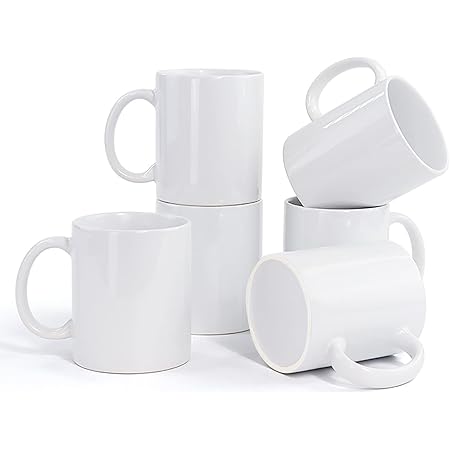
You are a GUI agent. You are given a task and a screenshot of the screen. Output one action in this format:
    pyautogui.click(x=<x>, y=<y>)
    Task: Click on the mug handles
    This screenshot has height=450, width=450.
    Given the screenshot: What is the action you would take?
    pyautogui.click(x=320, y=77), pyautogui.click(x=120, y=105), pyautogui.click(x=39, y=245), pyautogui.click(x=412, y=225), pyautogui.click(x=404, y=378)